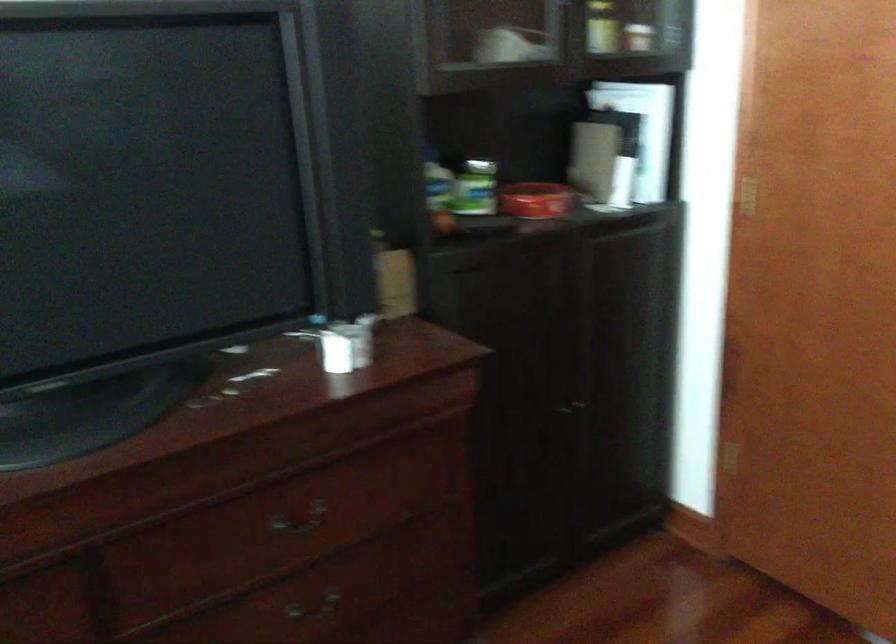
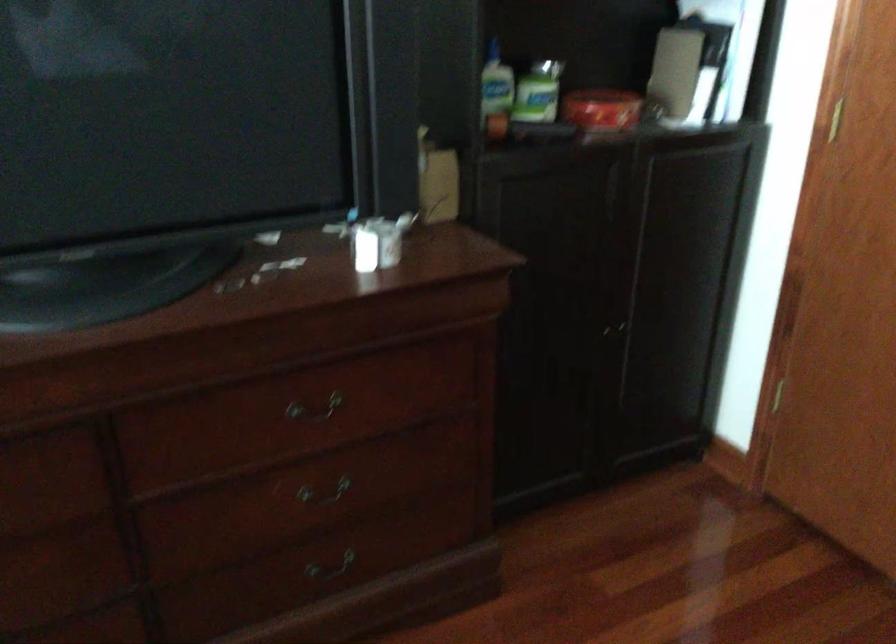
In the second image, find the point that corresponds to (475,191) in the first image.

(538, 91)